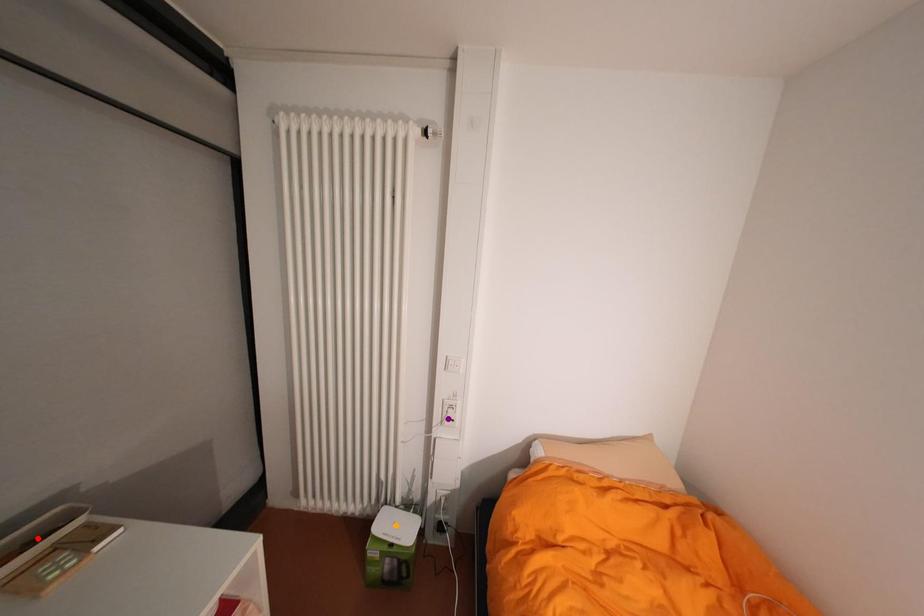
Order these from nearest to farthest:
purple point | red point | orange point

red point
purple point
orange point